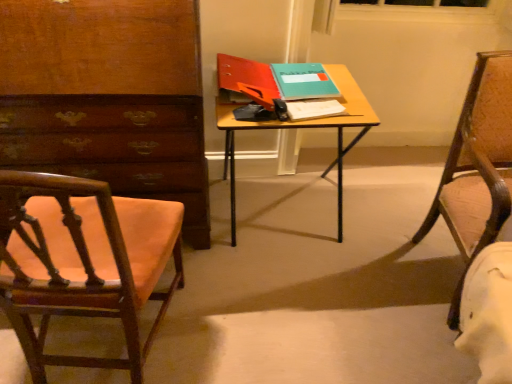
I want to click on vacant area that lies to the right of wooden chair at left, acting as the first chair starting from the left, so click(234, 323).